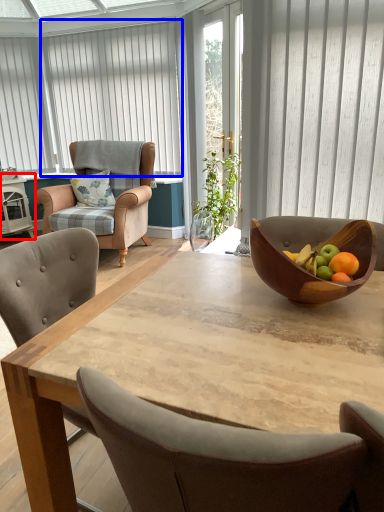
Question: Which point is closer to the camera, side table (highlighted by a red box) or curtain (highlighted by a blue box)?

Choices:
 (A) side table
 (B) curtain

Answer: (B)